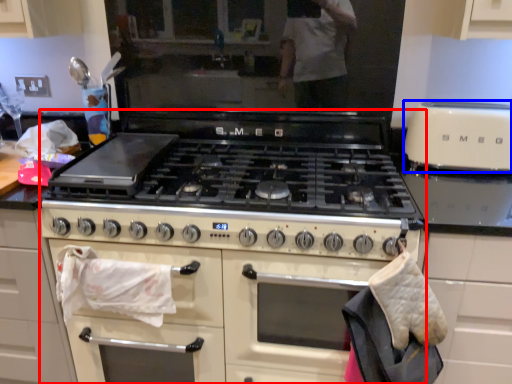
Question: Which object is further to the camera taking this photo, appliance (highlighted by a red box) or kitchen appliance (highlighted by a blue box)?

Choices:
 (A) appliance
 (B) kitchen appliance

Answer: (B)